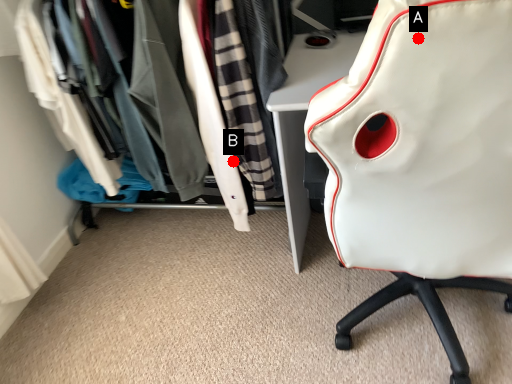
Question: Two points are circled on the image, labeled by A and B beside each circle. Which of the following is the closest to the observer?

Choices:
 (A) A is closer
 (B) B is closer

Answer: (A)